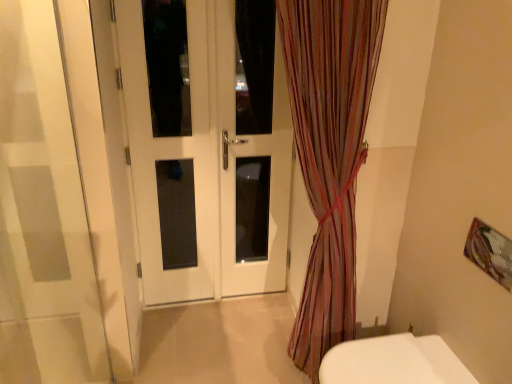
Question: Can you confirm if striped sheer curtain at center is positioned to the right of white glossy door at center?

Choices:
 (A) no
 (B) yes

Answer: (B)

Question: Does striped sheer curtain at center have a smaller size compared to white glossy door at center?

Choices:
 (A) no
 (B) yes

Answer: (A)

Question: From a real-world perspective, is striped sheer curtain at center positioned over white glossy door at center based on gravity?

Choices:
 (A) no
 (B) yes

Answer: (A)

Question: From a real-world perspective, is striped sheer curtain at center below white glossy door at center?

Choices:
 (A) yes
 (B) no

Answer: (A)

Question: From the image's perspective, is striped sheer curtain at center beneath white glossy door at center?

Choices:
 (A) yes
 (B) no

Answer: (A)

Question: Can you confirm if striped sheer curtain at center is thinner than white glossy door at center?

Choices:
 (A) no
 (B) yes

Answer: (A)

Question: Is white glass door at center far from white glossy toilet at lower right?

Choices:
 (A) no
 (B) yes

Answer: (B)

Question: Is white glass door at center positioned beyond the bounds of white glossy toilet at lower right?

Choices:
 (A) yes
 (B) no

Answer: (A)

Question: Is white glass door at center in front of white glossy toilet at lower right?

Choices:
 (A) no
 (B) yes

Answer: (A)

Question: Can you confirm if white glass door at center is smaller than white glossy toilet at lower right?

Choices:
 (A) yes
 (B) no

Answer: (B)

Question: Is white glossy toilet at lower right surrounded by white glass door at center?

Choices:
 (A) yes
 (B) no

Answer: (B)

Question: From the image's perspective, is white glass door at center on white glossy toilet at lower right?

Choices:
 (A) yes
 (B) no

Answer: (A)

Question: Can we say white glossy door at center lies outside metallic silver picture frame at upper right?

Choices:
 (A) no
 (B) yes

Answer: (B)